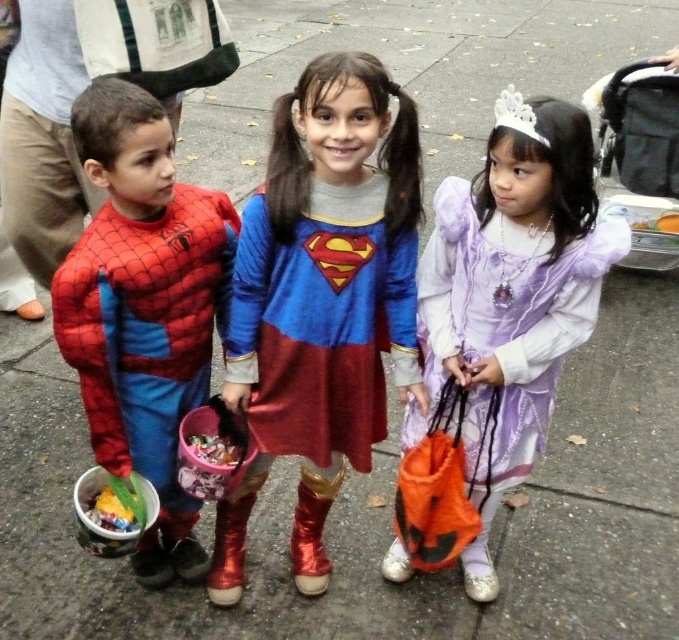
Question: Which object is farther from the camera taking this photo?

Choices:
 (A) black fabric stroller at upper right
 (B) purple satin dress at center
 (C) shiny blue dress at center

Answer: (A)

Question: Is purple satin dress at center in front of shiny spandex suit at left?

Choices:
 (A) yes
 (B) no

Answer: (B)

Question: Which point appears farthest from the camera in this image?

Choices:
 (A) (566, 333)
 (B) (145, 195)

Answer: (A)

Question: Which is farther from the shiny blue dress at center?

Choices:
 (A) purple satin dress at center
 (B) black fabric stroller at upper right
 (C) shiny spandex suit at left

Answer: (B)

Question: Is purple satin dress at center further to camera compared to black fabric stroller at upper right?

Choices:
 (A) yes
 (B) no

Answer: (B)

Question: Considering the relative positions of shiny blue dress at center and purple satin dress at center in the image provided, where is shiny blue dress at center located with respect to purple satin dress at center?

Choices:
 (A) left
 (B) right

Answer: (A)